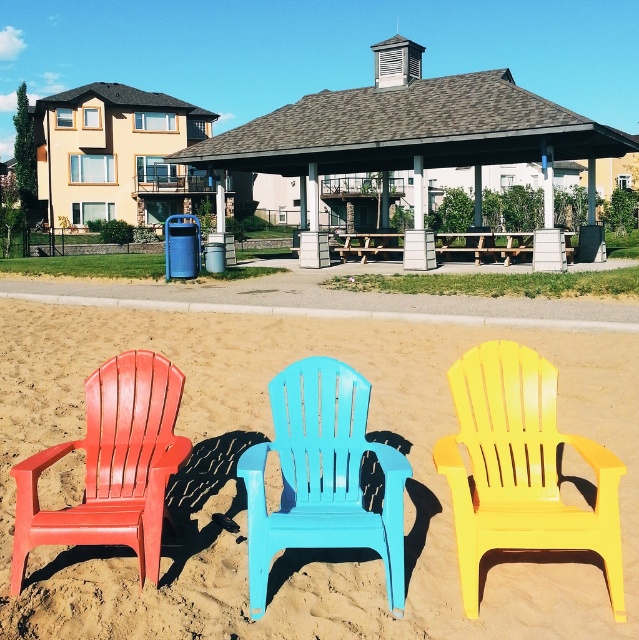
Locate an element on the screen. smooth sand at center is located at coordinates (270, 438).

Is smooth sand at center below light blue plastic chair at center?

Incorrect, smooth sand at center is not positioned below light blue plastic chair at center.

Which is behind, point (293, 620) or point (392, 579)?

The point (392, 579) is more distant.

At what (x,y) coordinates should I click in order to perform the action: click on smooth sand at center. Please return your answer as a coordinate pair (x, y). This screenshot has width=639, height=640. Looking at the image, I should click on (270, 438).

What do you see at coordinates (408, 136) in the screenshot? The height and width of the screenshot is (640, 639). I see `brown shingled gazebo at center` at bounding box center [408, 136].

In the scene shown: Can you confirm if brown shingled gazebo at center is positioned to the left of yellow plastic beach chair at center?

No, brown shingled gazebo at center is not to the left of yellow plastic beach chair at center.

Where is `brown shingled gazebo at center`? brown shingled gazebo at center is located at coordinates (408, 136).

Is point (378, 509) farther from camera compared to point (458, 86)?

No, (378, 509) is closer to viewer.

I want to click on smooth sand at center, so click(270, 438).

Describe the element at coordinates (270, 438) in the screenshot. I see `smooth sand at center` at that location.

The height and width of the screenshot is (640, 639). I want to click on smooth sand at center, so click(x=270, y=438).